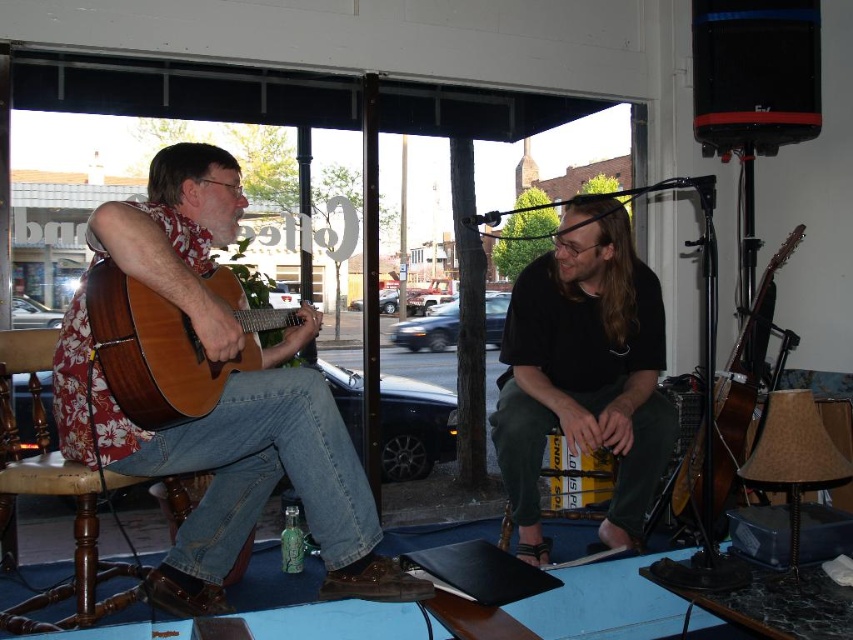
Who is lower down, brown wooden stool at lower left or brown acoustic guitar at right?

brown wooden stool at lower left is below.

Is brown wooden stool at lower left positioned before brown acoustic guitar at right?

Yes, it is in front of brown acoustic guitar at right.

Image resolution: width=853 pixels, height=640 pixels. What do you see at coordinates (73, 538) in the screenshot?
I see `brown wooden stool at lower left` at bounding box center [73, 538].

The image size is (853, 640). Find the location of `brown wooden stool at lower left`. brown wooden stool at lower left is located at coordinates (x=73, y=538).

Between natural wood acoustic guitar at left and brown wooden stool at lower left, which one appears on the right side from the viewer's perspective?

From the viewer's perspective, natural wood acoustic guitar at left appears more on the right side.

Is natural wood acoustic guitar at left to the left of brown wooden stool at lower left from the viewer's perspective?

Incorrect, natural wood acoustic guitar at left is not on the left side of brown wooden stool at lower left.

Locate an element on the screen. The image size is (853, 640). natural wood acoustic guitar at left is located at coordinates (167, 344).

The image size is (853, 640). I want to click on natural wood acoustic guitar at left, so click(167, 344).

Does wooden acoustic guitar at left have a smaller size compared to natural wood acoustic guitar at left?

Actually, wooden acoustic guitar at left might be larger than natural wood acoustic guitar at left.

Does wooden acoustic guitar at left lie behind natural wood acoustic guitar at left?

That is False.

Locate an element on the screen. wooden acoustic guitar at left is located at coordinates (236, 468).